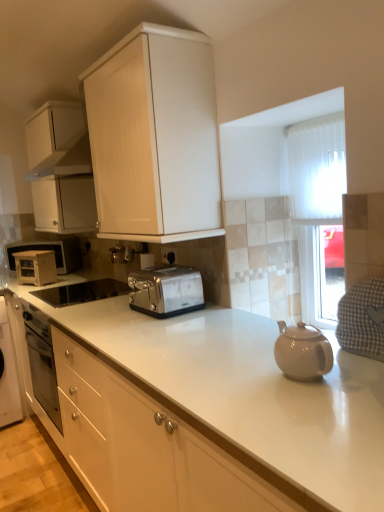
Question: Is the surface of gray checkered cloth at right in direct contact with satin silver toaster at left, which is counted as the second appliance, starting from the front?

Choices:
 (A) yes
 (B) no

Answer: (B)

Question: From a real-world perspective, is gray checkered cloth at right physically above satin silver toaster at left, which is counted as the second appliance, starting from the front?

Choices:
 (A) no
 (B) yes

Answer: (B)

Question: Considering the relative sizes of gray checkered cloth at right and satin silver toaster at left, which ranks as the second appliance in back-to-front order, in the image provided, is gray checkered cloth at right smaller than satin silver toaster at left, which ranks as the second appliance in back-to-front order,?

Choices:
 (A) yes
 (B) no

Answer: (A)

Question: Could you tell me if gray checkered cloth at right is turned towards satin silver toaster at left, which is counted as the second appliance, starting from the front?

Choices:
 (A) no
 (B) yes

Answer: (A)

Question: Does gray checkered cloth at right have a larger size compared to satin silver toaster at left, which ranks as the second appliance in back-to-front order?

Choices:
 (A) yes
 (B) no

Answer: (B)

Question: Is gray checkered cloth at right positioned beyond the bounds of satin silver toaster at left, which ranks as the second appliance in back-to-front order?

Choices:
 (A) yes
 (B) no

Answer: (A)

Question: From the image's perspective, is gray checkered cloth at right below white matte microwave at left, the 1th appliance positioned from the back?

Choices:
 (A) yes
 (B) no

Answer: (A)

Question: Does gray checkered cloth at right come behind white matte microwave at left, the 1th appliance positioned from the back?

Choices:
 (A) yes
 (B) no

Answer: (B)

Question: Can white matte microwave at left, which appears as the third appliance when viewed from the front, be found inside gray checkered cloth at right?

Choices:
 (A) yes
 (B) no

Answer: (B)

Question: Can you confirm if gray checkered cloth at right is taller than white matte microwave at left, the 1th appliance positioned from the back?

Choices:
 (A) yes
 (B) no

Answer: (B)

Question: Can you confirm if gray checkered cloth at right is thinner than white matte microwave at left, which appears as the third appliance when viewed from the front?

Choices:
 (A) no
 (B) yes

Answer: (B)

Question: Does gray checkered cloth at right have a smaller size compared to white matte microwave at left, the 1th appliance positioned from the back?

Choices:
 (A) no
 (B) yes

Answer: (B)

Question: Is the depth of white matte microwave at left, which appears as the third appliance when viewed from the front, less than that of gray checkered cloth at right?

Choices:
 (A) yes
 (B) no

Answer: (B)